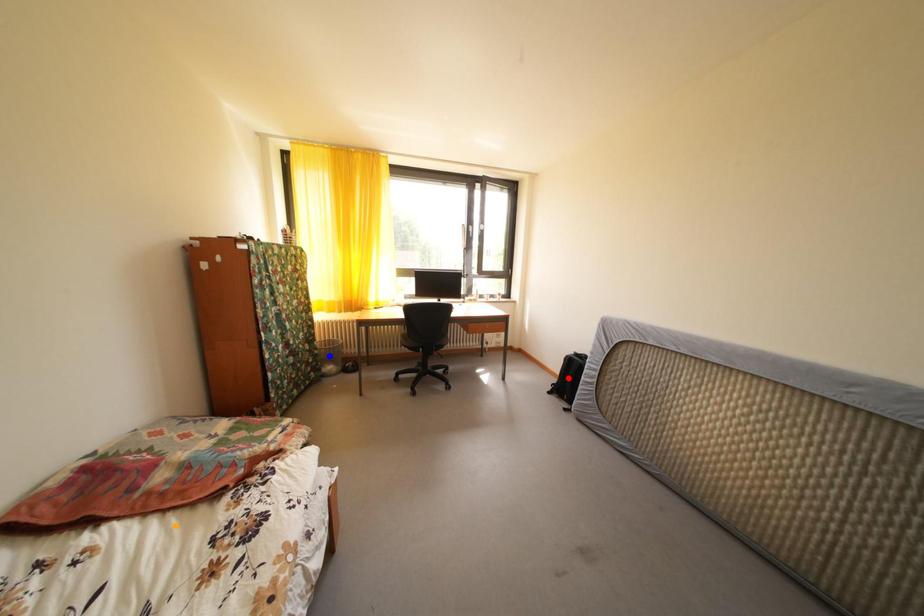
Order these from nearest to farthest:
1. orange point
2. red point
3. blue point

1. orange point
2. blue point
3. red point